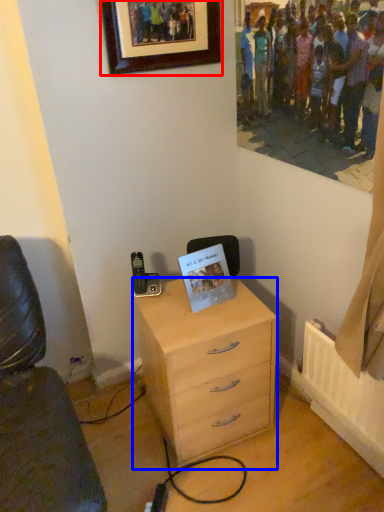
Question: Among these objects, which one is farthest to the camera, picture frame (highlighted by a red box) or chest of drawers (highlighted by a blue box)?

Choices:
 (A) picture frame
 (B) chest of drawers

Answer: (B)